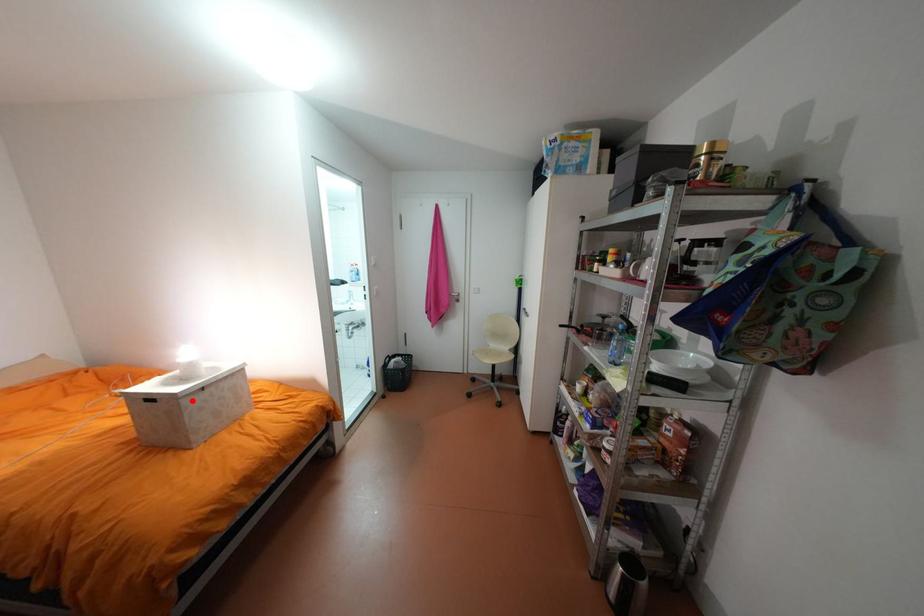
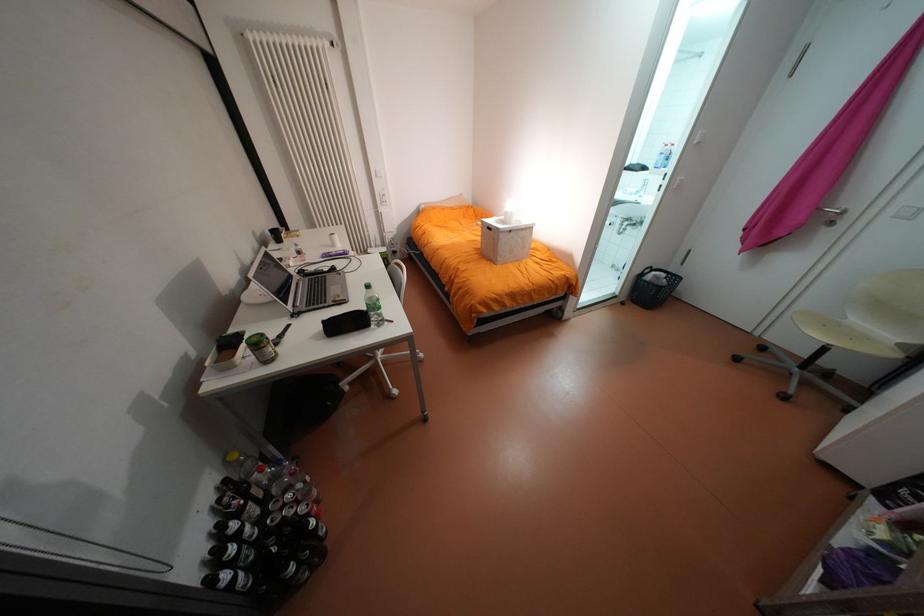
Question: I am providing you with two images of the same scene from different viewpoints. Given a red point in image1, look at the same physical point in image2. Is it:

Choices:
 (A) Closer to the viewpoint
 (B) Farther from the viewpoint

Answer: (A)